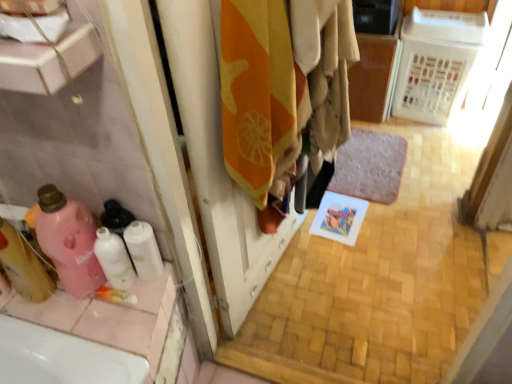
Question: Considering the relative positions of translucent pink bottle at left, marked as the first cleaning product in a left-to-right arrangement, and orange fabric at center in the image provided, is translucent pink bottle at left, marked as the first cleaning product in a left-to-right arrangement, behind orange fabric at center?

Choices:
 (A) no
 (B) yes

Answer: (B)

Question: From a real-world perspective, is translucent pink bottle at left, marked as the first cleaning product in a left-to-right arrangement, over orange fabric at center?

Choices:
 (A) no
 (B) yes

Answer: (B)

Question: From a real-world perspective, is translucent pink bottle at left, marked as the first cleaning product in a left-to-right arrangement, below orange fabric at center?

Choices:
 (A) no
 (B) yes

Answer: (A)

Question: Is orange fabric at center a part of translucent pink bottle at left, marked as the first cleaning product in a left-to-right arrangement?

Choices:
 (A) no
 (B) yes

Answer: (A)

Question: Is the position of translucent pink bottle at left, which ranks as the third cleaning product in right-to-left order, less distant than that of orange fabric at center?

Choices:
 (A) yes
 (B) no

Answer: (B)

Question: Relative to white matte toilet paper at lower left, is orange cotton towel at center in front or behind?

Choices:
 (A) behind
 (B) front

Answer: (B)

Question: Considering the relative positions of orange cotton towel at center and white matte toilet paper at lower left in the image provided, is orange cotton towel at center to the left or to the right of white matte toilet paper at lower left?

Choices:
 (A) right
 (B) left

Answer: (A)

Question: From the image's perspective, relative to white matte toilet paper at lower left, is orange cotton towel at center above or below?

Choices:
 (A) below
 (B) above

Answer: (B)

Question: Is orange cotton towel at center taller or shorter than white matte toilet paper at lower left?

Choices:
 (A) short
 (B) tall

Answer: (B)

Question: From the image's perspective, relative to white matte toilet paper at lower left, is orange fabric at center above or below?

Choices:
 (A) below
 (B) above

Answer: (B)

Question: Considering the positions of orange fabric at center and white matte toilet paper at lower left in the image, is orange fabric at center taller or shorter than white matte toilet paper at lower left?

Choices:
 (A) short
 (B) tall

Answer: (B)

Question: In terms of width, does orange fabric at center look wider or thinner when compared to white matte toilet paper at lower left?

Choices:
 (A) thin
 (B) wide

Answer: (A)

Question: Based on their sizes in the image, would you say orange fabric at center is bigger or smaller than white matte toilet paper at lower left?

Choices:
 (A) big
 (B) small

Answer: (A)

Question: In terms of width, does orange cotton towel at center look wider or thinner when compared to translucent pink bottle at left, marked as the first cleaning product in a left-to-right arrangement?

Choices:
 (A) wide
 (B) thin

Answer: (A)

Question: In the image, is orange cotton towel at center on the left side or the right side of translucent pink bottle at left, marked as the first cleaning product in a left-to-right arrangement?

Choices:
 (A) left
 (B) right

Answer: (B)